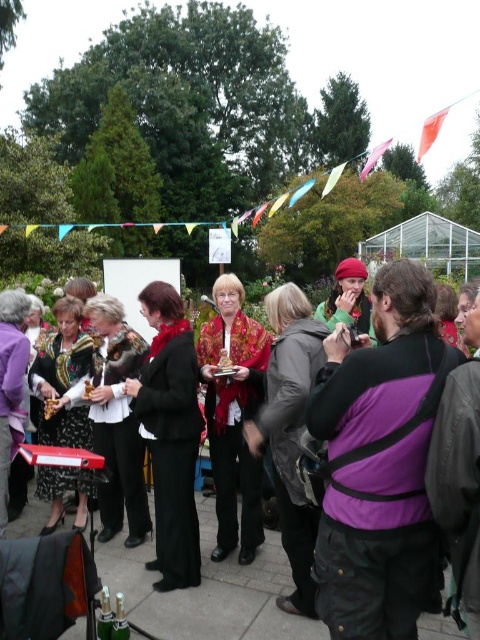
Who is positioned more to the right, floral-patterned scarf at center or floral-patterned fabric dress at lower left?

floral-patterned scarf at center is more to the right.

Is point (240, 368) positioned after point (62, 340)?

That is False.

Which is behind, point (257, 474) or point (85, 372)?

The point (85, 372) is behind.

Identify the location of floral-patterned scarf at center. Image resolution: width=480 pixels, height=640 pixels. (233, 416).

Which is above, black velvet dress at center or floral-patterned fabric dress at lower left?

floral-patterned fabric dress at lower left is above.

Can you confirm if black velvet dress at center is taller than floral-patterned fabric dress at lower left?

No, black velvet dress at center is not taller than floral-patterned fabric dress at lower left.

Locate an element on the screen. The height and width of the screenshot is (640, 480). black velvet dress at center is located at coordinates (x=116, y=420).

What do you see at coordinates (11, 381) in the screenshot? I see `purple fabric jacket at lower left` at bounding box center [11, 381].

Is purple fabric jacket at lower left wider than green fabric scarf at center?

Incorrect, purple fabric jacket at lower left's width does not surpass green fabric scarf at center's.

Is point (21, 324) positioned behind point (328, 328)?

Yes.

Image resolution: width=480 pixels, height=640 pixels. I want to click on purple fabric jacket at lower left, so click(x=11, y=381).